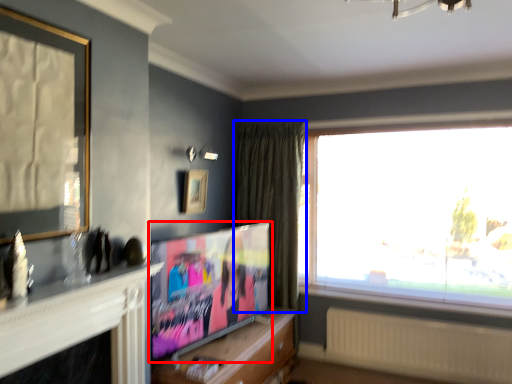
Question: Among these objects, which one is farthest to the camera, television (highlighted by a red box) or curtain (highlighted by a blue box)?

Choices:
 (A) television
 (B) curtain

Answer: (B)